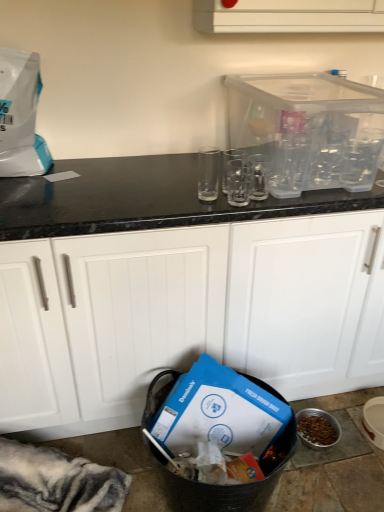
Question: Would you say white matte cabinet at center is a long distance from transparent plastic container at upper right?

Choices:
 (A) no
 (B) yes

Answer: (A)

Question: Is white matte cabinet at center positioned before transparent plastic container at upper right?

Choices:
 (A) yes
 (B) no

Answer: (A)

Question: From a real-world perspective, does white matte cabinet at center stand above transparent plastic container at upper right?

Choices:
 (A) no
 (B) yes

Answer: (A)

Question: From the image's perspective, is white matte cabinet at center located above transparent plastic container at upper right?

Choices:
 (A) no
 (B) yes

Answer: (A)

Question: Is white matte cabinet at center behind transparent plastic container at upper right?

Choices:
 (A) no
 (B) yes

Answer: (A)

Question: Does point (322, 137) appear closer or farther from the camera than point (200, 153)?

Choices:
 (A) closer
 (B) farther

Answer: (A)

Question: From the image's perspective, is transparent plastic container at upper right located above or below transparent glass at center, which is the first clear in left-to-right order?

Choices:
 (A) below
 (B) above

Answer: (B)

Question: In the image, is transparent plastic container at upper right positioned in front of or behind transparent glass at center, acting as the 3th clear starting from the right?

Choices:
 (A) front
 (B) behind

Answer: (A)

Question: Would you say transparent plastic container at upper right is inside or outside transparent glass at center, which is the first clear in left-to-right order?

Choices:
 (A) outside
 (B) inside

Answer: (A)

Question: Does point (286, 137) appear closer or farther from the camera than point (246, 168)?

Choices:
 (A) closer
 (B) farther

Answer: (B)

Question: Relative to clear glass at center, which ranks as the 2th clear in left-to-right order, is transparent plastic container at upper right in front or behind?

Choices:
 (A) front
 (B) behind

Answer: (A)

Question: Is transparent plastic container at upper right inside or outside of clear glass at center, which ranks as the 2th clear in left-to-right order?

Choices:
 (A) inside
 (B) outside

Answer: (B)

Question: From the image's perspective, is transparent plastic container at upper right above or below clear glass at center, positioned as the second clear in right-to-left order?

Choices:
 (A) above
 (B) below

Answer: (A)

Question: Is white matte cabinet at center inside or outside of transparent plastic container at upper right?

Choices:
 (A) outside
 (B) inside

Answer: (A)

Question: Is white matte cabinet at center taller or shorter than transparent plastic container at upper right?

Choices:
 (A) tall
 (B) short

Answer: (A)